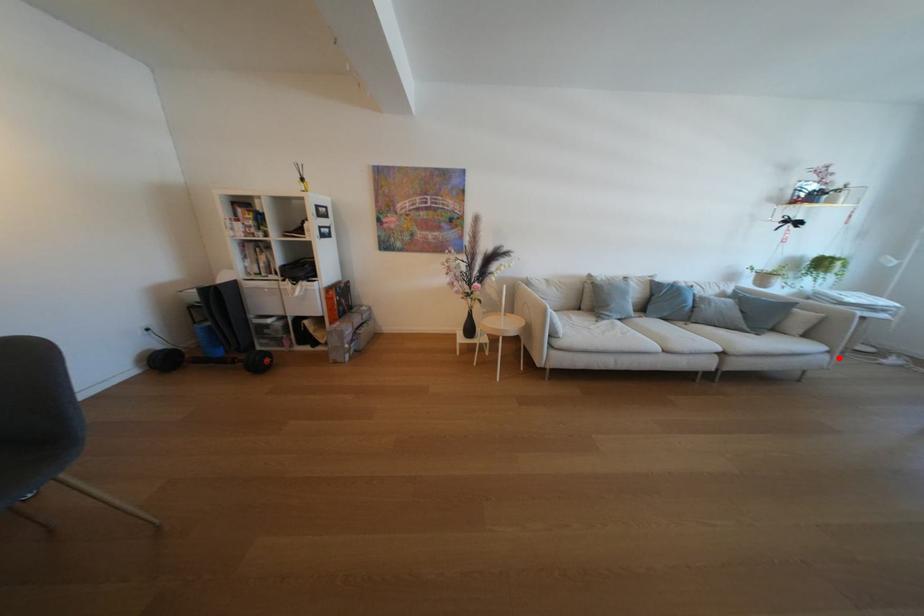
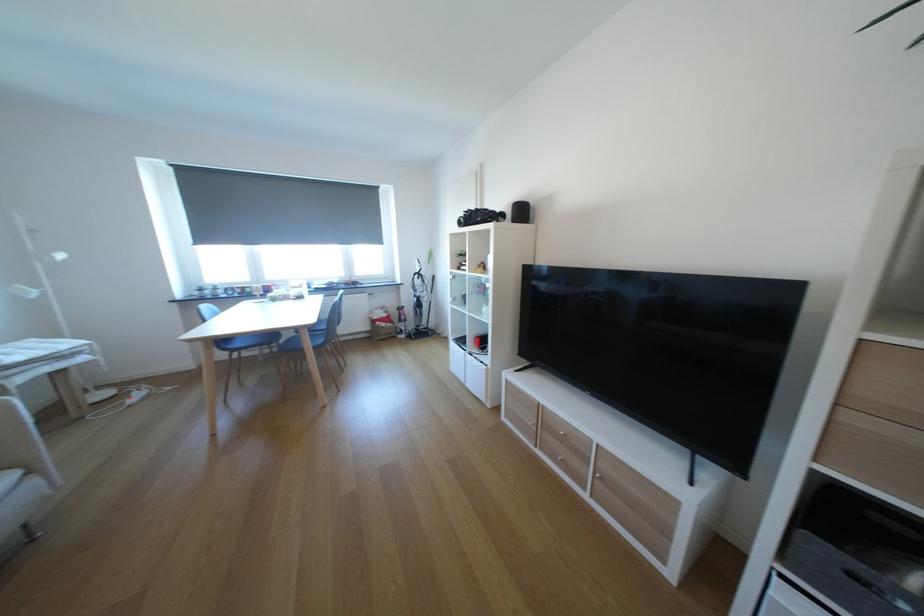
Question: I am providing you with two images of the same scene from different viewpoints. A red point is marked on the first image. Can you still see the location of the red point in image 2?

Choices:
 (A) Yes
 (B) No

Answer: (A)